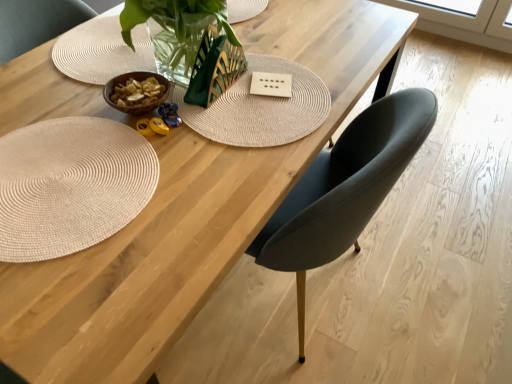
What are the coordinates of `free spot below natural woven mat at lower left (from a real-world perspective)` in the screenshot? It's located at (64, 187).